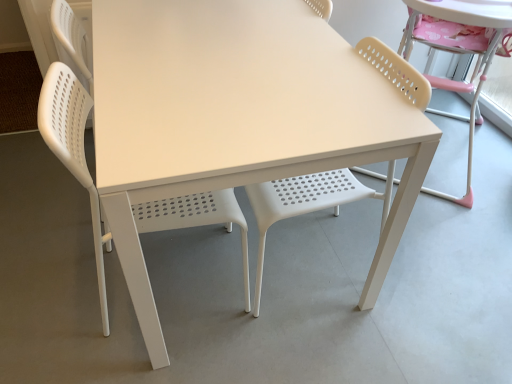
What do you see at coordinates (458, 52) in the screenshot? I see `beige perforated chair at right, placed as the 3th chair when sorted from left to right` at bounding box center [458, 52].

This screenshot has width=512, height=384. Identify the location of white plastic chair at left, arranged as the 3th chair when viewed from the right. (73, 149).

This screenshot has height=384, width=512. What do you see at coordinates (237, 116) in the screenshot? I see `white plastic table at center` at bounding box center [237, 116].

Locate an element on the screen. beige perforated chair at right, the first chair viewed from the right is located at coordinates (458, 52).

Could you measure the distance between white plastic chair at left, which ranks as the 1th chair in left-to-right order, and beige perforated chair at right, the first chair viewed from the right?

They are 3.78 feet apart.

Does point (187, 199) come behind point (478, 20)?

No, (187, 199) is closer to viewer.

Looking at this image, based on their positions, is white plastic chair at left, which ranks as the 1th chair in left-to-right order, located to the left or right of beige perforated chair at right, placed as the 3th chair when sorted from left to right?

Clearly, white plastic chair at left, which ranks as the 1th chair in left-to-right order, is on the left of beige perforated chair at right, placed as the 3th chair when sorted from left to right, in the image.

Is white plastic chair at left, arranged as the 3th chair when viewed from the right, bigger than beige perforated chair at right, the first chair viewed from the right?

Actually, white plastic chair at left, arranged as the 3th chair when viewed from the right, might be smaller than beige perforated chair at right, the first chair viewed from the right.

Is beige perforated chair at right, the first chair viewed from the right, with white plastic table at center?

There is a gap between beige perforated chair at right, the first chair viewed from the right, and white plastic table at center.

From the image's perspective, relative to white plastic table at center, is beige perforated chair at right, placed as the 3th chair when sorted from left to right, above or below?

From the image's perspective, beige perforated chair at right, placed as the 3th chair when sorted from left to right, appears above white plastic table at center.

Which object is wider, beige perforated chair at right, the first chair viewed from the right, or white plastic table at center?

white plastic table at center.

At what (x,y) coordinates should I click in order to perform the action: click on table directly beneath the beige perforated chair at right, placed as the 3th chair when sorted from left to right (from a real-world perspective). Please return your answer as a coordinate pair (x, y). Looking at the image, I should click on (237, 116).

Which object is wider, white plastic table at center or white plastic chair at left, arranged as the 3th chair when viewed from the right?

white plastic table at center is wider.

Is white plastic table at center next to white plastic chair at left, which ranks as the 1th chair in left-to-right order, and touching it?

Result: white plastic table at center and white plastic chair at left, which ranks as the 1th chair in left-to-right order, are not in contact.

From a real-world perspective, is white plastic table at center physically below white plastic chair at left, arranged as the 3th chair when viewed from the right?

Yes, from a real-world perspective, white plastic table at center is below white plastic chair at left, arranged as the 3th chair when viewed from the right.

Considering the positions of points (129, 68) and (53, 90), is point (129, 68) closer to camera compared to point (53, 90)?

No, (129, 68) is behind (53, 90).

Which is further, [119,252] or [399,85]?

The point [399,85] is farther.

Considering the sizes of objects white plastic table at center and matte white chair at center, placed as the second chair when sorted from right to left, in the image provided, who is smaller, white plastic table at center or matte white chair at center, placed as the second chair when sorted from right to left,?

With smaller size is matte white chair at center, placed as the second chair when sorted from right to left.

Which chair is the 1st one when counting from the left side of the white plastic table at center? Please provide its 2D coordinates.

[(308, 202)]

Which object is further away from the camera taking this photo, white plastic table at center or matte white chair at center, which ranks as the 2th chair in left-to-right order?

white plastic table at center is behind.

Image resolution: width=512 pixels, height=384 pixels. Identify the location of table that is below the beige perforated chair at right, placed as the 3th chair when sorted from left to right (from the image's perspective). (237, 116).

Which of these two, white plastic table at center or beige perforated chair at right, placed as the 3th chair when sorted from left to right, is smaller?

Smaller between the two is white plastic table at center.

Considering the positions of objects white plastic table at center and beige perforated chair at right, the first chair viewed from the right, in the image provided, who is in front, white plastic table at center or beige perforated chair at right, the first chair viewed from the right,?

white plastic table at center is more forward.

Is white plastic table at center positioned far away from beige perforated chair at right, the first chair viewed from the right?

They are positioned close to each other.

Based on the photo, is white plastic chair at left, which ranks as the 1th chair in left-to-right order, not within white plastic table at center?

Yes, white plastic chair at left, which ranks as the 1th chair in left-to-right order, is located beyond the bounds of white plastic table at center.

In terms of height, does white plastic chair at left, arranged as the 3th chair when viewed from the right, look taller or shorter compared to white plastic table at center?

Considering their sizes, white plastic chair at left, arranged as the 3th chair when viewed from the right, has more height than white plastic table at center.

From the image's perspective, is white plastic chair at left, arranged as the 3th chair when viewed from the right, located beneath white plastic table at center?

Incorrect, from the image's perspective, white plastic chair at left, arranged as the 3th chair when viewed from the right, is higher than white plastic table at center.

Which of these two, white plastic chair at left, which ranks as the 1th chair in left-to-right order, or white plastic table at center, is thinner?

With smaller width is white plastic chair at left, which ranks as the 1th chair in left-to-right order.

Is beige perforated chair at right, the first chair viewed from the right, located outside matte white chair at center, which ranks as the 2th chair in left-to-right order?

beige perforated chair at right, the first chair viewed from the right, lies outside matte white chair at center, which ranks as the 2th chair in left-to-right order,'s area.

Between beige perforated chair at right, the first chair viewed from the right, and matte white chair at center, which ranks as the 2th chair in left-to-right order, which one has smaller width?

matte white chair at center, which ranks as the 2th chair in left-to-right order, is thinner.

Is the surface of beige perforated chair at right, the first chair viewed from the right, in direct contact with matte white chair at center, which ranks as the 2th chair in left-to-right order?

They are not placed beside each other.

The width and height of the screenshot is (512, 384). In order to click on the 2nd chair behind the white plastic chair at left, which ranks as the 1th chair in left-to-right order, counting from the anchor's position in this screenshot , I will do `click(458, 52)`.

You are a GUI agent. You are given a task and a screenshot of the screen. Output one action in this format:
    pyautogui.click(x=<x>, y=<y>)
    Task: Click on the chair that is the 3rd one above the white plastic table at center (from a real-world perspective)
    This screenshot has width=512, height=384.
    Given the screenshot: What is the action you would take?
    pyautogui.click(x=458, y=52)

Which object lies nearer to the anchor point white plastic chair at left, arranged as the 3th chair when viewed from the right, white plastic table at center or matte white chair at center, placed as the second chair when sorted from right to left?

The object closer to white plastic chair at left, arranged as the 3th chair when viewed from the right, is white plastic table at center.

Which object lies nearer to the anchor point white plastic table at center, matte white chair at center, placed as the second chair when sorted from right to left, or beige perforated chair at right, placed as the 3th chair when sorted from left to right?

matte white chair at center, placed as the second chair when sorted from right to left, is positioned closer to the anchor white plastic table at center.

When comparing their distances from white plastic table at center, does matte white chair at center, placed as the second chair when sorted from right to left, or white plastic chair at left, which ranks as the 1th chair in left-to-right order, seem further?

matte white chair at center, placed as the second chair when sorted from right to left, is further to white plastic table at center.

From the image, which object appears to be nearer to beige perforated chair at right, the first chair viewed from the right, white plastic table at center or white plastic chair at left, arranged as the 3th chair when viewed from the right?

white plastic table at center is positioned closer to the anchor beige perforated chair at right, the first chair viewed from the right.

From the image, which object appears to be farther from white plastic table at center, white plastic chair at left, which ranks as the 1th chair in left-to-right order, or matte white chair at center, which ranks as the 2th chair in left-to-right order?

Based on the image, matte white chair at center, which ranks as the 2th chair in left-to-right order, appears to be further to white plastic table at center.

Based on their spatial positions, is beige perforated chair at right, the first chair viewed from the right, or matte white chair at center, placed as the second chair when sorted from right to left, further from white plastic table at center?

beige perforated chair at right, the first chair viewed from the right, is further to white plastic table at center.

From the image, which object appears to be nearer to white plastic chair at left, which ranks as the 1th chair in left-to-right order, white plastic table at center or beige perforated chair at right, placed as the 3th chair when sorted from left to right?

white plastic table at center.

Based on their spatial positions, is matte white chair at center, which ranks as the 2th chair in left-to-right order, or beige perforated chair at right, the first chair viewed from the right, further from white plastic chair at left, arranged as the 3th chair when viewed from the right?

Based on the image, beige perforated chair at right, the first chair viewed from the right, appears to be further to white plastic chair at left, arranged as the 3th chair when viewed from the right.

The height and width of the screenshot is (384, 512). Identify the location of table between matte white chair at center, placed as the second chair when sorted from right to left, and beige perforated chair at right, placed as the 3th chair when sorted from left to right, in the horizontal direction. (237, 116).

Find the location of a particular element. The height and width of the screenshot is (384, 512). table between white plastic chair at left, arranged as the 3th chair when viewed from the right, and beige perforated chair at right, placed as the 3th chair when sorted from left to right, in the horizontal direction is located at coordinates (237, 116).

Where is `chair between white plastic chair at left, which ranks as the 1th chair in left-to-right order, and beige perforated chair at right, placed as the 3th chair when sorted from left to right, in the horizontal direction`? This screenshot has width=512, height=384. chair between white plastic chair at left, which ranks as the 1th chair in left-to-right order, and beige perforated chair at right, placed as the 3th chair when sorted from left to right, in the horizontal direction is located at coordinates (308, 202).

Locate an element on the screen. Image resolution: width=512 pixels, height=384 pixels. chair between white plastic chair at left, arranged as the 3th chair when viewed from the right, and white plastic table at center, in the horizontal direction is located at coordinates (308, 202).